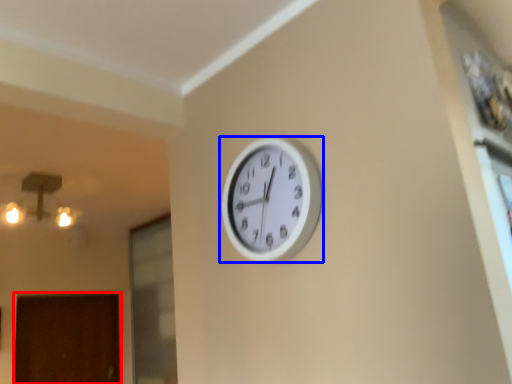
Question: Which object appears farthest to the camera in this image, door (highlighted by a red box) or wall clock (highlighted by a blue box)?

Choices:
 (A) door
 (B) wall clock

Answer: (A)